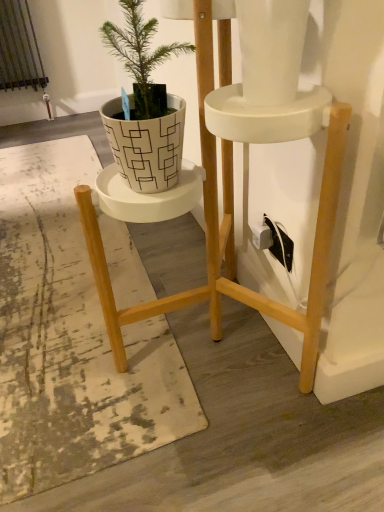
The height and width of the screenshot is (512, 384). Describe the element at coordinates (144, 106) in the screenshot. I see `white geometric-patterned pot at center-left` at that location.

Locate an element on the screen. The image size is (384, 512). white geometric-patterned pot at center-left is located at coordinates (144, 106).

What do you see at coordinates (71, 339) in the screenshot?
I see `white textured mat at center` at bounding box center [71, 339].

This screenshot has height=512, width=384. I want to click on white textured mat at center, so click(x=71, y=339).

The image size is (384, 512). I want to click on white geometric-patterned pot at center-left, so click(144, 106).

Considering the relative positions of white textured mat at center and white geometric-patterned pot at center-left in the image provided, is white textured mat at center to the left of white geometric-patterned pot at center-left from the viewer's perspective?

Yes.

Considering their positions, is white textured mat at center located in front of or behind white geometric-patterned pot at center-left?

Clearly, white textured mat at center is behind white geometric-patterned pot at center-left.

Which is further, (97, 165) or (155, 180)?

The point (97, 165) is farther.

From the image's perspective, between white textured mat at center and white geometric-patterned pot at center-left, which one is located above?

white geometric-patterned pot at center-left appears higher in the image.

From a real-world perspective, between white textured mat at center and white geometric-patterned pot at center-left, who is vertically lower?

white textured mat at center is physically lower.

In the scene shown: Is white textured mat at center wider than white geometric-patterned pot at center-left?

Yes, white textured mat at center is wider than white geometric-patterned pot at center-left.

Considering the relative sizes of white textured mat at center and white geometric-patterned pot at center-left in the image provided, is white textured mat at center shorter than white geometric-patterned pot at center-left?

Yes, white textured mat at center is shorter than white geometric-patterned pot at center-left.

Considering the sizes of objects white textured mat at center and white geometric-patterned pot at center-left in the image provided, who is smaller, white textured mat at center or white geometric-patterned pot at center-left?

Smaller between the two is white geometric-patterned pot at center-left.

Choose the correct answer: Is white textured mat at center inside white geometric-patterned pot at center-left or outside it?

The correct answer is: outside.

Is white textured mat at center with white geometric-patterned pot at center-left?

No, white textured mat at center is not beside white geometric-patterned pot at center-left.

Is white textured mat at center turned away from white geometric-patterned pot at center-left?

No, white textured mat at center is not facing away from white geometric-patterned pot at center-left.

What's the angular difference between white textured mat at center and white geometric-patterned pot at center-left's facing directions?

90.8 degrees separate the facing orientations of white textured mat at center and white geometric-patterned pot at center-left.

Measure the distance from white textured mat at center to white geometric-patterned pot at center-left.

white textured mat at center is 28.19 inches from white geometric-patterned pot at center-left.

Image resolution: width=384 pixels, height=512 pixels. In order to click on houseplant above the white textured mat at center (from a real-world perspective) in this screenshot , I will do `click(144, 106)`.

Which is more to the right, white geometric-patterned pot at center-left or white textured mat at center?

white geometric-patterned pot at center-left is more to the right.

Relative to white textured mat at center, is white geometric-patterned pot at center-left in front or behind?

Visually, white geometric-patterned pot at center-left is located in front of white textured mat at center.

Between point (138, 33) and point (10, 153), which one is positioned in front?

The point (138, 33) is closer to the camera.

From the image's perspective, would you say white geometric-patterned pot at center-left is shown under white textured mat at center?

Actually, white geometric-patterned pot at center-left appears above white textured mat at center in the image.

From a real-world perspective, which is physically above, white geometric-patterned pot at center-left or white textured mat at center?

In real-world perspective, white geometric-patterned pot at center-left is above.

Between white geometric-patterned pot at center-left and white textured mat at center, which one has smaller width?

Thinner between the two is white geometric-patterned pot at center-left.

Which of these two, white geometric-patterned pot at center-left or white textured mat at center, stands taller?

white geometric-patterned pot at center-left.

Does white geometric-patterned pot at center-left have a smaller size compared to white textured mat at center?

Indeed, white geometric-patterned pot at center-left has a smaller size compared to white textured mat at center.

Is white geometric-patterned pot at center-left outside of white textured mat at center?

Absolutely, white geometric-patterned pot at center-left is external to white textured mat at center.

Is white geometric-patterned pot at center-left not near white textured mat at center?

That's not correct — white geometric-patterned pot at center-left is a little close to white textured mat at center.

Is white geometric-patterned pot at center-left oriented away from white textured mat at center?

No, white geometric-patterned pot at center-left is not facing away from white textured mat at center.

How much distance is there between white geometric-patterned pot at center-left and white textured mat at center?

The distance of white geometric-patterned pot at center-left from white textured mat at center is 28.19 inches.

The height and width of the screenshot is (512, 384). Identify the location of mat below the white geometric-patterned pot at center-left (from a real-world perspective). (71, 339).

Where is `mat that appears below the white geometric-patterned pot at center-left (from the image's perspective)`? The height and width of the screenshot is (512, 384). mat that appears below the white geometric-patterned pot at center-left (from the image's perspective) is located at coordinates (71, 339).

Find the location of a particular element. houseplant in front of the white textured mat at center is located at coordinates (144, 106).